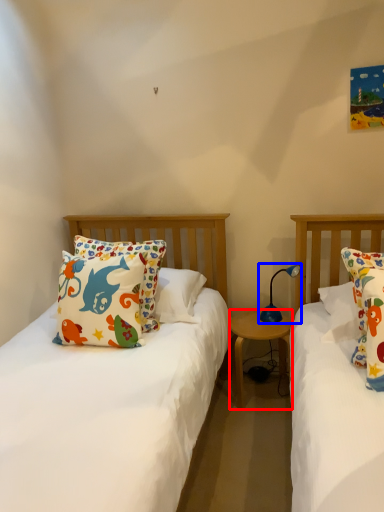
Question: Which object is closer to the camera taking this photo, nightstand (highlighted by a red box) or lamp (highlighted by a blue box)?

Choices:
 (A) nightstand
 (B) lamp

Answer: (B)